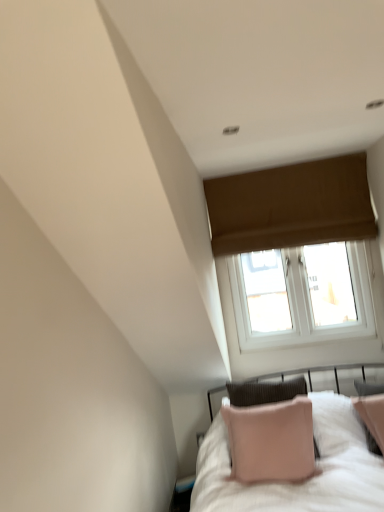
Question: Is brown fabric window at upper center at the right side of pink fabric pillow at lower right?

Choices:
 (A) no
 (B) yes

Answer: (B)

Question: Is brown fabric window at upper center wider than pink fabric pillow at lower right?

Choices:
 (A) yes
 (B) no

Answer: (B)

Question: Is brown fabric window at upper center completely or partially outside of pink fabric pillow at lower right?

Choices:
 (A) no
 (B) yes

Answer: (B)

Question: Can you confirm if brown fabric window at upper center is positioned to the left of pink fabric pillow at lower right?

Choices:
 (A) yes
 (B) no

Answer: (B)

Question: Is brown fabric window at upper center thinner than pink fabric pillow at lower right?

Choices:
 (A) yes
 (B) no

Answer: (A)

Question: From a real-world perspective, is brown fabric window at upper center positioned over pink fabric pillow at lower right based on gravity?

Choices:
 (A) yes
 (B) no

Answer: (A)

Question: Is pink fabric pillow at lower right looking in the opposite direction of brown fabric window at upper center?

Choices:
 (A) yes
 (B) no

Answer: (B)

Question: From the image's perspective, would you say pink fabric pillow at lower right is positioned over brown fabric window at upper center?

Choices:
 (A) yes
 (B) no

Answer: (B)

Question: Does pink fabric pillow at lower right have a lesser width compared to brown fabric window at upper center?

Choices:
 (A) no
 (B) yes

Answer: (A)

Question: Does pink fabric pillow at lower right have a larger size compared to brown fabric window at upper center?

Choices:
 (A) yes
 (B) no

Answer: (A)

Question: From a real-world perspective, is pink fabric pillow at lower right below brown fabric window at upper center?

Choices:
 (A) yes
 (B) no

Answer: (A)

Question: Considering the relative positions of pink fabric pillow at lower right and brown fabric window at upper center in the image provided, is pink fabric pillow at lower right to the right of brown fabric window at upper center from the viewer's perspective?

Choices:
 (A) no
 (B) yes

Answer: (A)

Question: Is brown fabric window at upper center to the left or to the right of pink fabric pillow at lower right in the image?

Choices:
 (A) left
 (B) right

Answer: (B)